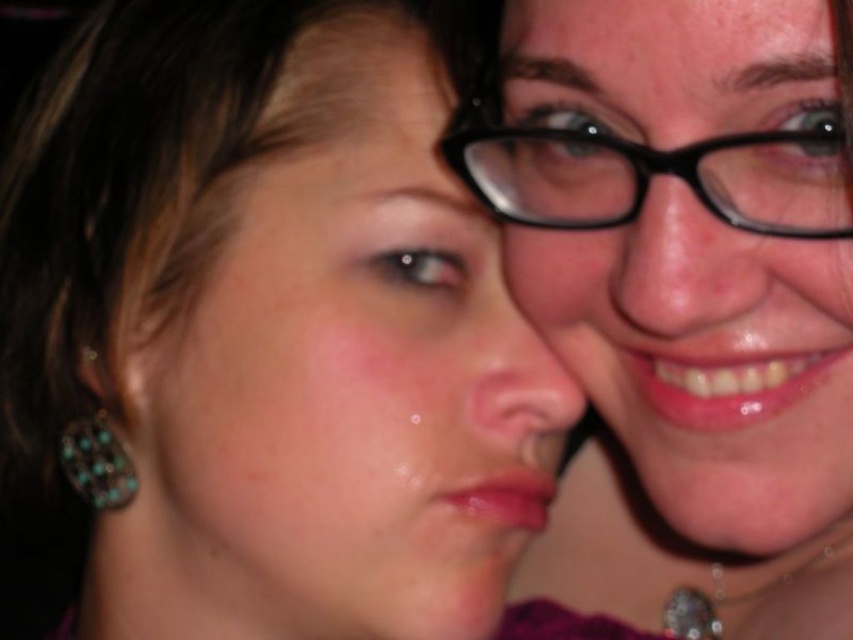
Who is taller, black plastic glasses at upper center or turquoise gemstone earrings at lower left?

black plastic glasses at upper center

Who is more distant from viewer, (776, 131) or (79, 467)?

The point (79, 467) is more distant.

The height and width of the screenshot is (640, 853). What are the coordinates of `black plastic glasses at upper center` in the screenshot? It's located at (660, 173).

In the scene shown: Who is shorter, matte black glasses at upper center or black plastic glasses at upper center?

black plastic glasses at upper center is shorter.

Is matte black glasses at upper center to the right of black plastic glasses at upper center from the viewer's perspective?

Indeed, matte black glasses at upper center is positioned on the right side of black plastic glasses at upper center.

Between point (699, 260) and point (747, 173), which one is positioned in front?

Point (747, 173) is in front.

At what (x,y) coordinates should I click in order to perform the action: click on matte black glasses at upper center. Please return your answer as a coordinate pair (x, y). This screenshot has width=853, height=640. Looking at the image, I should click on (686, 300).

Is matte black hair at upper left above matte black glasses at upper center?

Indeed, matte black hair at upper left is positioned over matte black glasses at upper center.

Between matte black hair at upper left and matte black glasses at upper center, which one appears on the right side from the viewer's perspective?

matte black glasses at upper center is more to the right.

In order to click on matte black hair at upper left in this screenshot , I will do `click(268, 328)`.